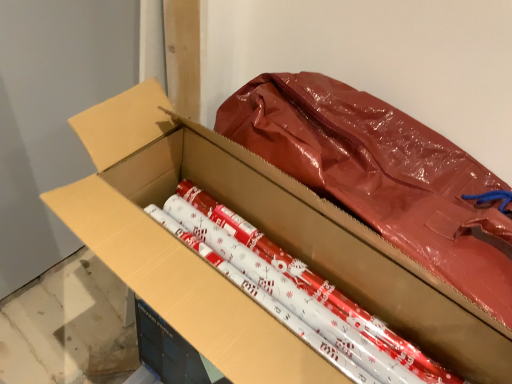
Question: Choose the correct answer: Is matte cardboard box at center inside shiny metallic wrapping paper at center or outside it?

Choices:
 (A) outside
 (B) inside

Answer: (A)

Question: Considering their positions, is matte cardboard box at center located in front of or behind shiny metallic wrapping paper at center?

Choices:
 (A) front
 (B) behind

Answer: (A)

Question: From a real-world perspective, relative to shiny metallic wrapping paper at center, is matte cardboard box at center vertically above or below?

Choices:
 (A) below
 (B) above

Answer: (B)

Question: Is shiny metallic wrapping paper at center bigger or smaller than matte cardboard box at center?

Choices:
 (A) small
 (B) big

Answer: (A)

Question: In the image, is shiny metallic wrapping paper at center positioned in front of or behind matte cardboard box at center?

Choices:
 (A) behind
 (B) front

Answer: (A)

Question: From the image's perspective, is shiny metallic wrapping paper at center located above or below matte cardboard box at center?

Choices:
 (A) above
 (B) below

Answer: (A)

Question: Considering the relative positions of shiny metallic wrapping paper at center and matte cardboard box at center in the image provided, is shiny metallic wrapping paper at center to the left or to the right of matte cardboard box at center?

Choices:
 (A) left
 (B) right

Answer: (B)